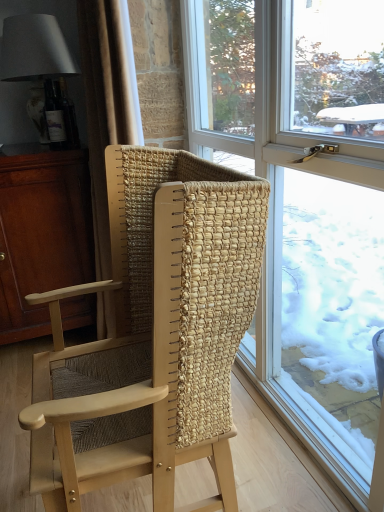
Question: Considering the positions of point (213, 268) and point (82, 234), is point (213, 268) closer or farther from the camera than point (82, 234)?

Choices:
 (A) farther
 (B) closer

Answer: (B)

Question: In terms of width, does natural woven wood chair at center look wider or thinner when compared to matte brown cabinet at left?

Choices:
 (A) wide
 (B) thin

Answer: (B)

Question: Which is farther from the matte white lampshade at upper left?

Choices:
 (A) natural woven wood chair at center
 (B) matte brown cabinet at left
 (C) clear glass window at center
 (D) beige woven curtain at left

Answer: (A)

Question: Which of these objects is positioned farthest from the matte white lampshade at upper left?

Choices:
 (A) matte brown cabinet at left
 (B) clear glass window at center
 (C) natural woven wood chair at center
 (D) beige woven curtain at left

Answer: (C)